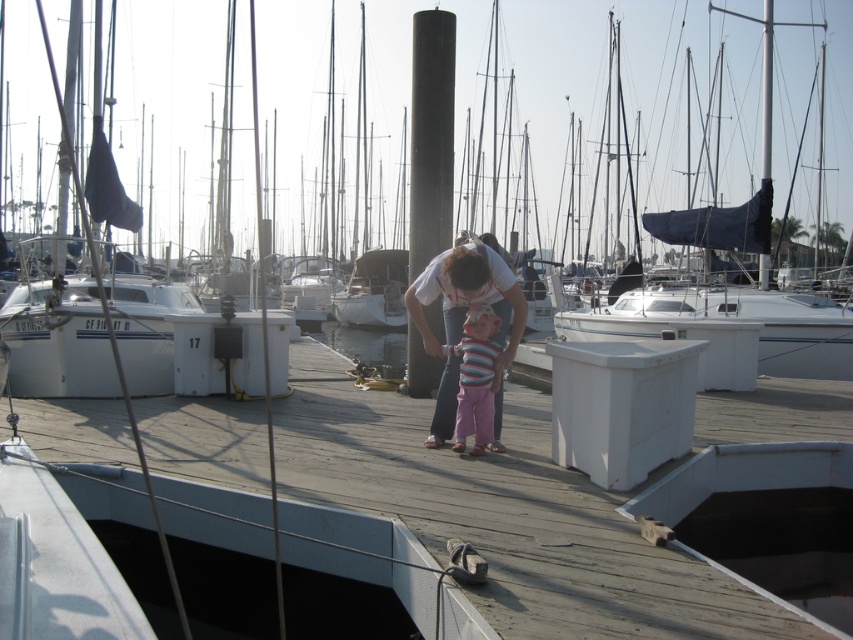
You are a photographer trying to capture a candid shot of the striped fabric at center without including the white cotton shirt at center. Based on their positions, is this possible?

The white cotton shirt at center is located above striped fabric at center, so if you position your camera below the white cotton shirt at center, you can capture the striped fabric at center without including it.